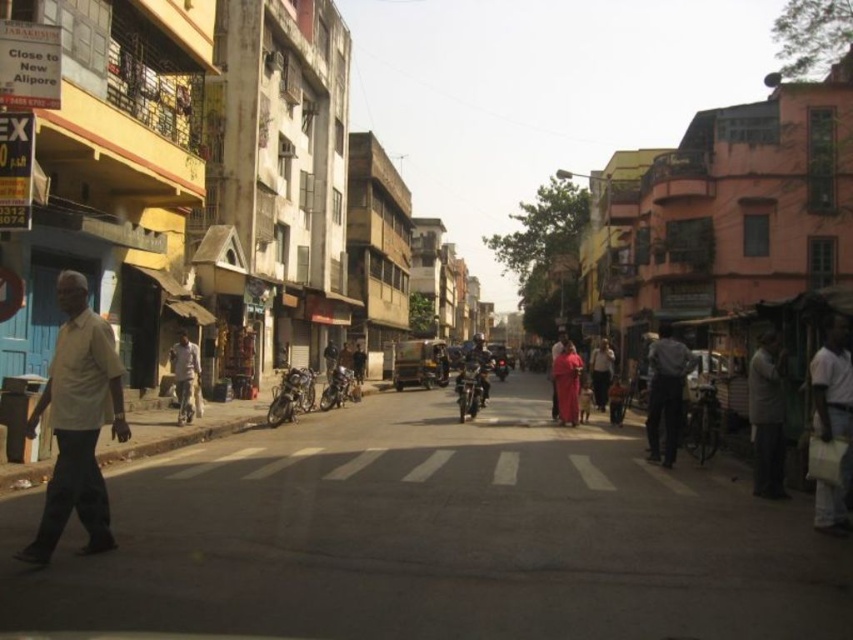
You are a delivery person who needs to park your motorcycle in a specific spot at coordinates 0.605, 0.553. Is the shiny metallic motorcycle at center currently occupying that spot?

Yes, the shiny metallic motorcycle at center is already occupying the coordinates (471, 387).

You are standing on the bustling street scene in India and want to take a photo. There are two points of interest marked as point (465, 371) and point (486, 387). Which point will appear larger in your camera view?

Point (465, 371) will appear larger in your camera view because it is closer to the camera than point (486, 387).

You are standing at the pedestrian crossing on the busy street. You see two points marked on the ground ahead of you. The first point is at coordinates point (177, 376) and the second is at point (480, 392). Which point is closer to your current position?

Point (177, 376) is closer to the camera than point (480, 392), so the first point is closer to your current position.